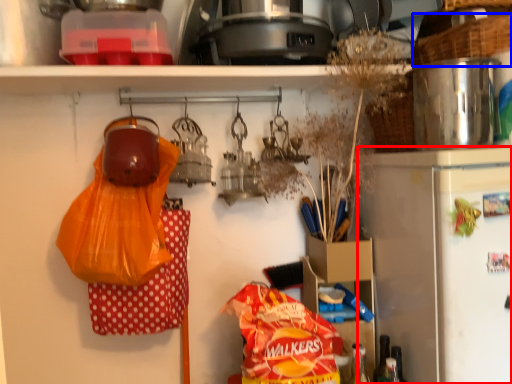
Question: Which of the following is the farthest to the observer, refrigerator (highlighted by a red box) or basket (highlighted by a blue box)?

Choices:
 (A) refrigerator
 (B) basket

Answer: (B)